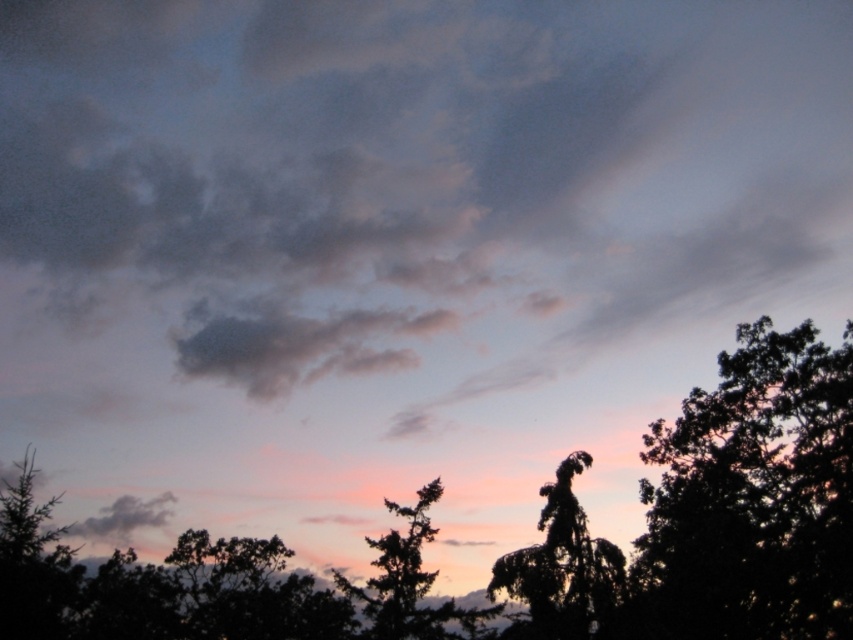
From the picture: Is silhouette tree at center taller than dark green leafy tree at right?

Indeed, silhouette tree at center has a greater height compared to dark green leafy tree at right.

The width and height of the screenshot is (853, 640). I want to click on silhouette tree at center, so click(532, 545).

Is dark green leafy tree at right taller than dark green leafy tree at lower right?

Indeed, dark green leafy tree at right has a greater height compared to dark green leafy tree at lower right.

Is point (727, 401) more distant than point (585, 621)?

That is True.

This screenshot has width=853, height=640. I want to click on dark green leafy tree at right, so click(x=753, y=497).

Identify the location of dark green leafy tree at right. This screenshot has height=640, width=853. (753, 497).

Is dark green leafy tree at lower right bigger than silhouette tree at left?

Incorrect, dark green leafy tree at lower right is not larger than silhouette tree at left.

Identify the location of dark green leafy tree at lower right. (561, 564).